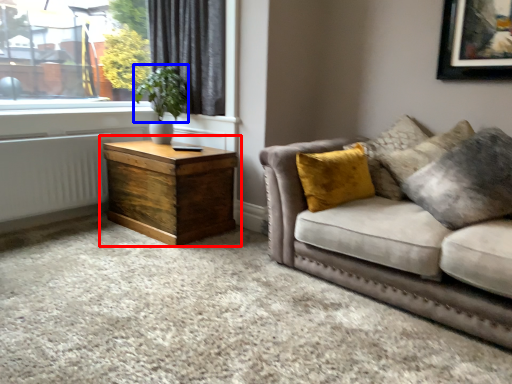
Question: Which object appears farthest to the camera in this image, nightstand (highlighted by a red box) or plant (highlighted by a blue box)?

Choices:
 (A) nightstand
 (B) plant

Answer: (B)